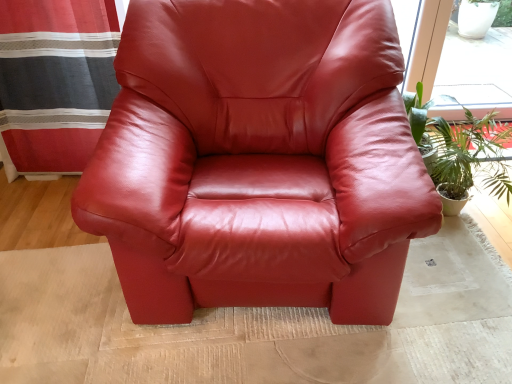
Question: Can you confirm if satin red armchair at center is positioned to the right of striped fabric curtain at left?

Choices:
 (A) no
 (B) yes

Answer: (B)

Question: Can you confirm if satin red armchair at center is taller than striped fabric curtain at left?

Choices:
 (A) no
 (B) yes

Answer: (B)

Question: Is the depth of satin red armchair at center less than that of striped fabric curtain at left?

Choices:
 (A) yes
 (B) no

Answer: (A)

Question: From the image's perspective, is satin red armchair at center below striped fabric curtain at left?

Choices:
 (A) yes
 (B) no

Answer: (A)

Question: Considering the relative positions of satin red armchair at center and striped fabric curtain at left in the image provided, is satin red armchair at center behind striped fabric curtain at left?

Choices:
 (A) no
 (B) yes

Answer: (A)

Question: Is striped fabric curtain at left at the back of satin red armchair at center?

Choices:
 (A) no
 (B) yes

Answer: (A)

Question: Are striped fabric curtain at left and green leafy plant at right far apart?

Choices:
 (A) no
 (B) yes

Answer: (B)

Question: Can you confirm if striped fabric curtain at left is wider than green leafy plant at right?

Choices:
 (A) no
 (B) yes

Answer: (A)

Question: Considering the relative positions of striped fabric curtain at left and green leafy plant at right in the image provided, is striped fabric curtain at left behind green leafy plant at right?

Choices:
 (A) no
 (B) yes

Answer: (B)

Question: Does striped fabric curtain at left have a lesser height compared to green leafy plant at right?

Choices:
 (A) no
 (B) yes

Answer: (A)

Question: Is striped fabric curtain at left in front of green leafy plant at right?

Choices:
 (A) yes
 (B) no

Answer: (B)

Question: From a real-world perspective, is striped fabric curtain at left located beneath green leafy plant at right?

Choices:
 (A) yes
 (B) no

Answer: (B)

Question: Does green leafy plant at right come behind satin red armchair at center?

Choices:
 (A) yes
 (B) no

Answer: (A)